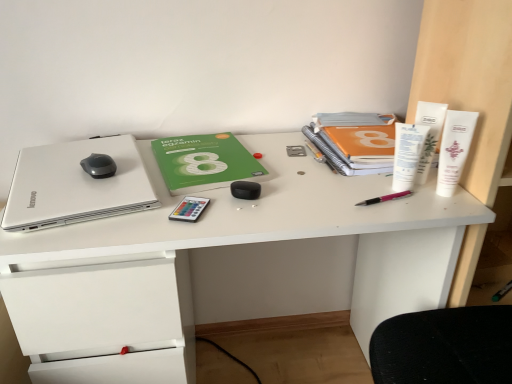
The width and height of the screenshot is (512, 384). In order to click on spots to the right of black plastic remote control at center-left, positioned as the fifth stationery in right-to-left order in this screenshot , I will do `click(270, 205)`.